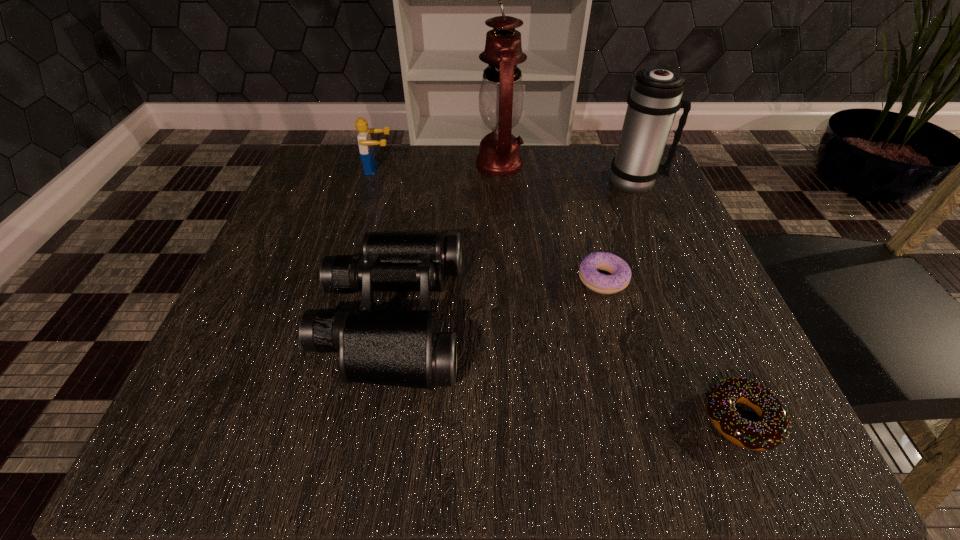
At what (x,y) coordinates should I click in order to perform the action: click on the tallest object. Please return your answer as a coordinate pair (x, y). The width and height of the screenshot is (960, 540). Looking at the image, I should click on (501, 98).

Locate an element on the screen. The height and width of the screenshot is (540, 960). the third object from left to right is located at coordinates (501, 98).

You are a GUI agent. You are given a task and a screenshot of the screen. Output one action in this format:
    pyautogui.click(x=<x>, y=<y>)
    Task: Click on the thermos bottle
    This screenshot has height=540, width=960.
    Given the screenshot: What is the action you would take?
    pyautogui.click(x=655, y=97)

Identify the location of Lego. Image resolution: width=960 pixels, height=540 pixels. (366, 149).

The height and width of the screenshot is (540, 960). I want to click on binoculars, so click(x=395, y=348).

Locate an element on the screen. This screenshot has height=540, width=960. the farther doughnut is located at coordinates (619, 279).

Identify the location of the fourth object from left to right. pos(619,279).

Identify the location of the right doughnut. (773, 428).

Find the location of a particular element. Image resolution: width=960 pixels, height=540 pixels. blank space located on the left of the tallest object is located at coordinates (381, 164).

Where is `free space located on the face of the Lego`? free space located on the face of the Lego is located at coordinates (544, 170).